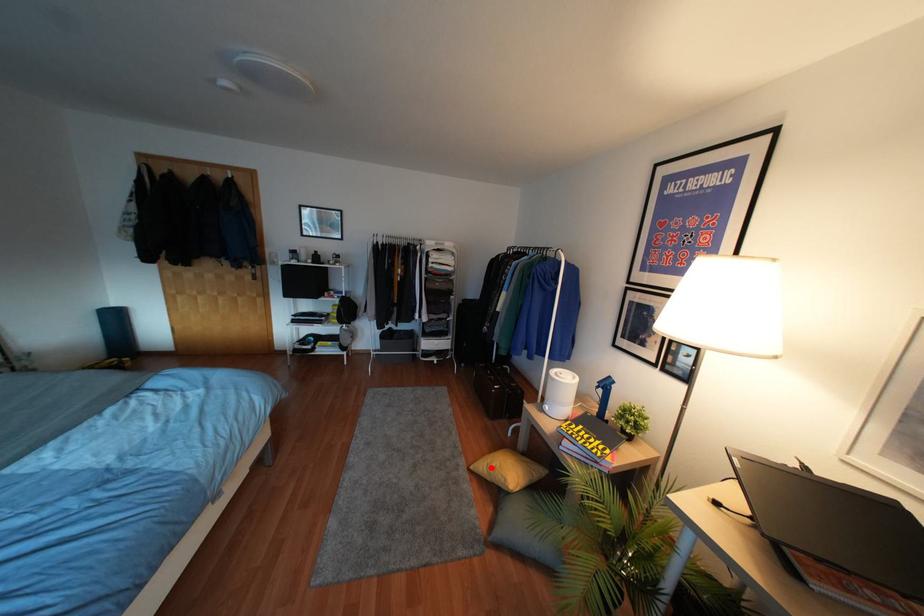
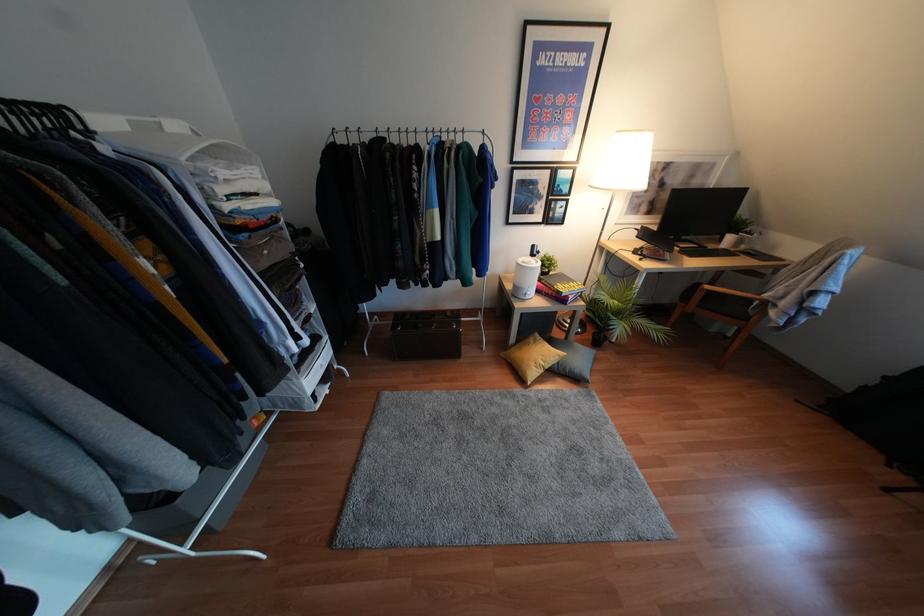
Question: I am providing you with two images of the same scene from different viewpoints. A red point is shown in image1. For the corresponding object point in image2, is it positioned nearer or farther from the camera?

Choices:
 (A) Nearer
 (B) Farther

Answer: (B)